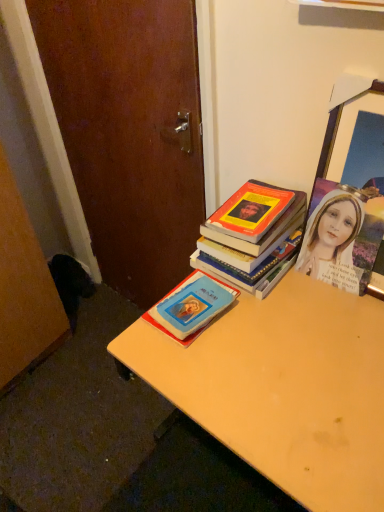
Identify the location of vacant space that is to the left of wooden picture frame at upper right. (283, 307).